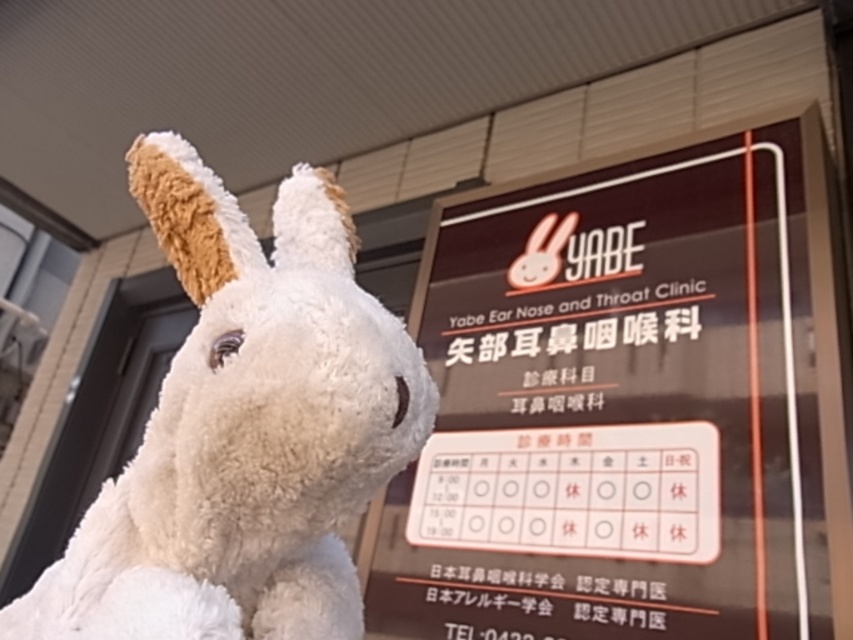
Does point (631, 273) come behind point (190, 445)?

That is True.

Who is higher up, matte black signboard at upper center or white plush toy at left?

Positioned higher is white plush toy at left.

Which is behind, point (660, 582) or point (244, 352)?

Positioned behind is point (660, 582).

Where is `matte black signboard at upper center`? matte black signboard at upper center is located at coordinates (628, 404).